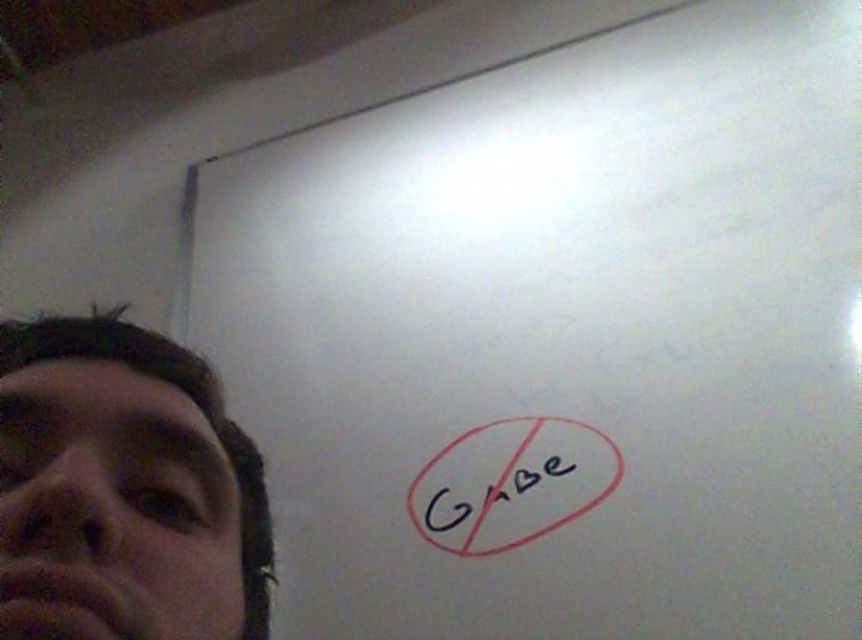
Question: Which object appears closest to the camera in this image?

Choices:
 (A) black marker at bottom right
 (B) black ink writing at center
 (C) matte black face at left

Answer: (C)

Question: Which of the following is the closest to the observer?

Choices:
 (A) (494, 525)
 (B) (242, 580)
 (C) (445, 492)

Answer: (B)

Question: Which of the following is the closest to the observer?

Choices:
 (A) (70, 346)
 (B) (445, 484)
 (C) (529, 476)

Answer: (A)

Question: Can you confirm if matte black face at left is thinner than black ink writing at center?

Choices:
 (A) yes
 (B) no

Answer: (A)

Question: Can you confirm if matte black face at left is positioned below black ink writing at center?

Choices:
 (A) yes
 (B) no

Answer: (B)

Question: Does matte black face at left lie behind black ink writing at center?

Choices:
 (A) yes
 (B) no

Answer: (B)